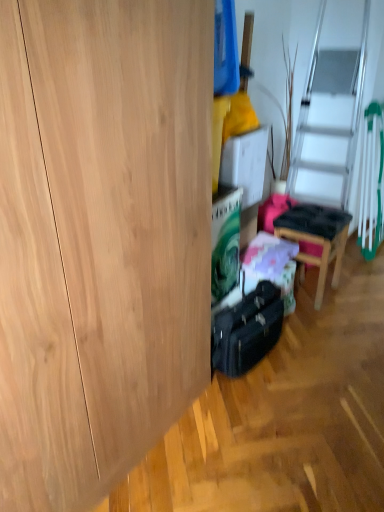
Question: Is point (266, 292) positioned closer to the camera than point (309, 262)?

Choices:
 (A) closer
 (B) farther

Answer: (A)

Question: Would you say black hardshell suitcase at center is inside or outside wooden chair at center?

Choices:
 (A) outside
 (B) inside

Answer: (A)

Question: Looking at their shapes, would you say black hardshell suitcase at center is wider or thinner than wooden chair at center?

Choices:
 (A) thin
 (B) wide

Answer: (A)

Question: Considering their positions, is wooden chair at center located in front of or behind black hardshell suitcase at center?

Choices:
 (A) behind
 (B) front

Answer: (A)

Question: Is wooden chair at center inside or outside of black hardshell suitcase at center?

Choices:
 (A) outside
 (B) inside

Answer: (A)

Question: Does point (327, 209) appear closer or farther from the camera than point (251, 338)?

Choices:
 (A) farther
 (B) closer

Answer: (A)

Question: Is wooden chair at center wider or thinner than black hardshell suitcase at center?

Choices:
 (A) wide
 (B) thin

Answer: (A)